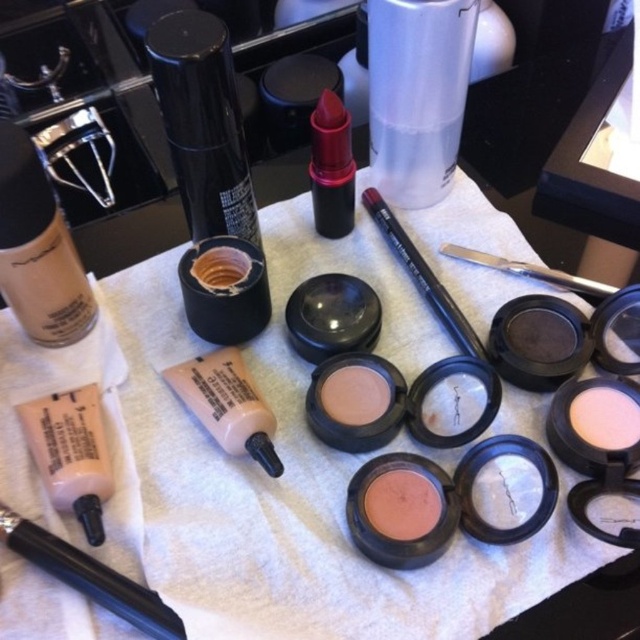
Question: Does matte brown powder at center appear under matte cream eyeshadow at center?

Choices:
 (A) yes
 (B) no

Answer: (B)

Question: Which point appears farthest from the camera in this image?

Choices:
 (A) (372, 499)
 (B) (365, 369)
 (C) (484, 400)

Answer: (B)

Question: Observing the image, what is the correct spatial positioning of matte cream foundation at upper left in reference to matte pink powder at center?

Choices:
 (A) below
 (B) above

Answer: (B)

Question: Which of the following is the farthest from the observer?

Choices:
 (A) matte beige eyeshadow at center
 (B) black plastic pen at lower left
 (C) matte cream foundation at upper left
 (D) black matte pen at center

Answer: (D)

Question: Can you confirm if translucent matte liquid foundation at lower left is positioned to the right of matte cream eyeshadow at center?

Choices:
 (A) no
 (B) yes

Answer: (A)

Question: Which of these objects is positioned closest to the black matte pen at center?

Choices:
 (A) metallic silver brush at upper right
 (B) matte plastic powder at center
 (C) matte brown powder at center
 (D) matte cream foundation at center-left

Answer: (A)